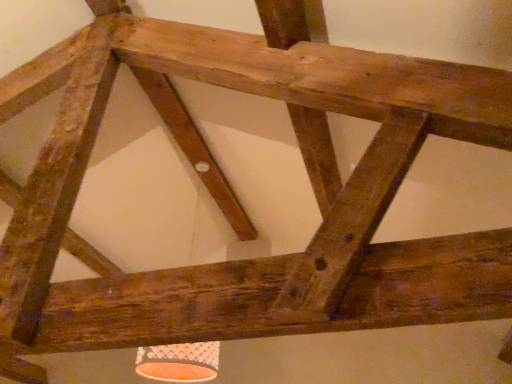
In order to face smooth brown plank at center, should I rotate leftwards or rightwards?

Turn left approximately 6.681 degrees to face it.

I want to click on smooth brown plank at center, so click(x=194, y=148).

Describe the element at coordinates (194, 148) in the screenshot. The height and width of the screenshot is (384, 512). I see `smooth brown plank at center` at that location.

The image size is (512, 384). Identify the location of smooth brown plank at center. (194, 148).